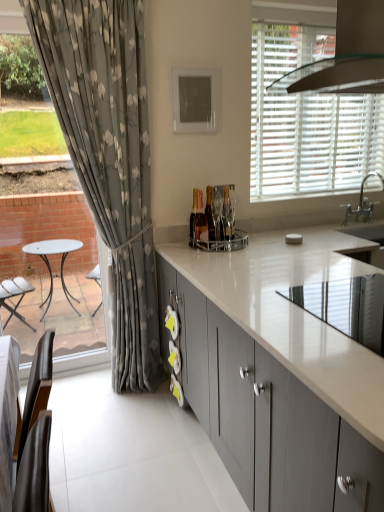
Question: Is white glossy sink at upper right bigger than clear glass exhaust hood at upper right?

Choices:
 (A) no
 (B) yes

Answer: (A)

Question: Is white glossy sink at upper right positioned beyond the bounds of clear glass exhaust hood at upper right?

Choices:
 (A) no
 (B) yes

Answer: (B)

Question: From the image's perspective, does white glossy sink at upper right appear higher than clear glass exhaust hood at upper right?

Choices:
 (A) no
 (B) yes

Answer: (A)

Question: Is the position of white glossy sink at upper right less distant than that of clear glass exhaust hood at upper right?

Choices:
 (A) no
 (B) yes

Answer: (A)

Question: From the image's perspective, is white glossy sink at upper right under clear glass exhaust hood at upper right?

Choices:
 (A) yes
 (B) no

Answer: (A)

Question: Is white glossy sink at upper right shorter than clear glass exhaust hood at upper right?

Choices:
 (A) no
 (B) yes

Answer: (B)

Question: Can you confirm if matte gray cabinets at center is taller than white matte blinds at upper right?

Choices:
 (A) yes
 (B) no

Answer: (B)

Question: Considering the relative sizes of matte gray cabinets at center and white matte blinds at upper right in the image provided, is matte gray cabinets at center wider than white matte blinds at upper right?

Choices:
 (A) yes
 (B) no

Answer: (A)

Question: Does matte gray cabinets at center have a smaller size compared to white matte blinds at upper right?

Choices:
 (A) no
 (B) yes

Answer: (A)

Question: Is matte gray cabinets at center oriented towards white matte blinds at upper right?

Choices:
 (A) no
 (B) yes

Answer: (A)

Question: Is white matte blinds at upper right at the back of matte gray cabinets at center?

Choices:
 (A) yes
 (B) no

Answer: (B)

Question: Does matte gray cabinets at center appear on the right side of white matte blinds at upper right?

Choices:
 (A) yes
 (B) no

Answer: (B)

Question: Is clear glass exhaust hood at upper right bigger than white glossy sink at upper right?

Choices:
 (A) yes
 (B) no

Answer: (A)